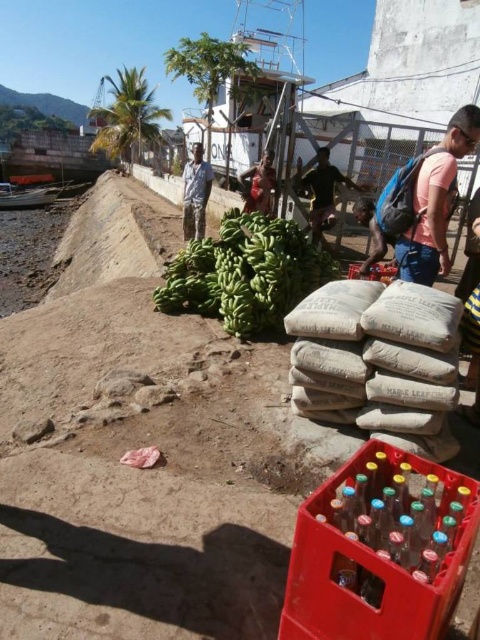
Question: Considering the real-world distances, which object is farthest from the matte blue backpack at center right?

Choices:
 (A) dark brown leather jacket at center
 (B) green matte bananas at center

Answer: (A)

Question: Observing the image, what is the correct spatial positioning of green matte bananas at center in reference to translucent plastic bottles at lower right?

Choices:
 (A) left
 (B) right

Answer: (A)

Question: Estimate the real-world distances between objects in this image. Which object is closer to the translucent plastic bottles at lower right?

Choices:
 (A) dark brown leather jacket at center
 (B) dark brown leather backpack at center
 (C) green matte bananas at center
 (D) matte blue backpack at center right

Answer: (D)

Question: Does green matte bananas at center have a lesser width compared to camouflage pants at center?

Choices:
 (A) no
 (B) yes

Answer: (A)

Question: Which object appears farthest from the camera in this image?

Choices:
 (A) translucent plastic bottles at lower right
 (B) green matte bananas at center
 (C) camouflage pants at center

Answer: (C)

Question: Does translucent plastic bottles at lower right have a smaller size compared to dark brown leather backpack at center?

Choices:
 (A) yes
 (B) no

Answer: (A)